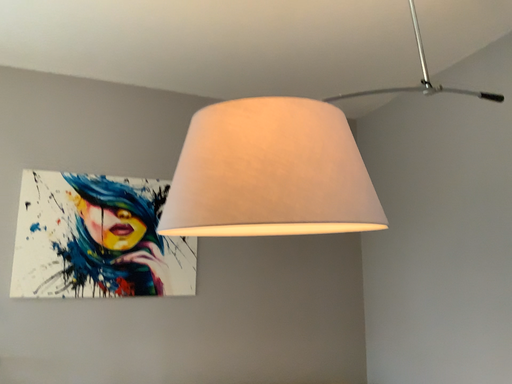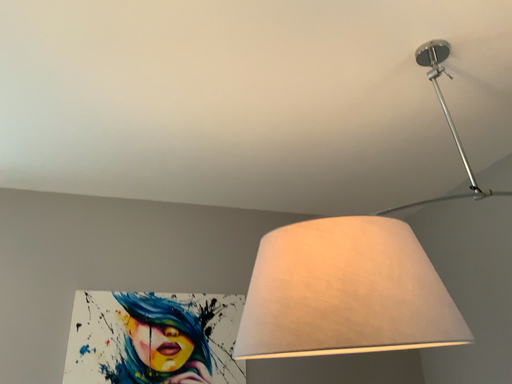
Question: Which way did the camera rotate in the video?

Choices:
 (A) rotated upward
 (B) rotated downward

Answer: (A)